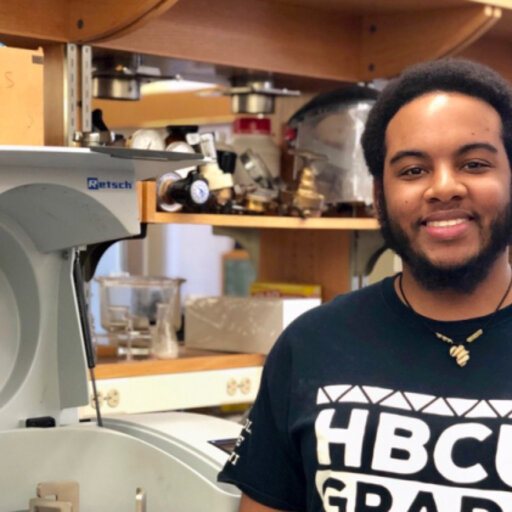
The width and height of the screenshot is (512, 512). What are the coordinates of `underside of wooden shelf at the top of the image` in the screenshot? It's located at (497, 51), (399, 30), (302, 31), (191, 18), (37, 15), (106, 9).